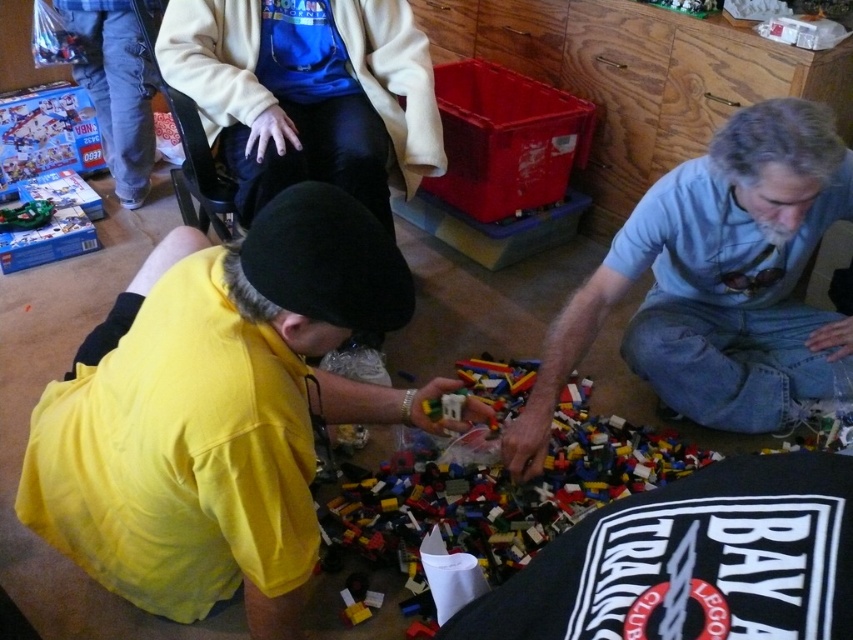
From the picture: You are a photographer trying to capture a closeup of the multicolored plastic bricks at center without the black fabric shirt at lower right appearing in the frame. Based on their sizes, is this possible?

The black fabric shirt at lower right has a smaller size compared to multicolored plastic bricks at center. Since the shirt is smaller, it might be easier to position the camera so that the shirt is out of the frame while focusing on the larger multicolored plastic bricks at center.

You are trying to find the gray hair man at lower right in the image. Where would you look relative to the black fabric shirt at lower right?

The gray hair man at lower right is located above the black fabric shirt at lower right, so you should look upwards from the black fabric shirt at lower right to find him.